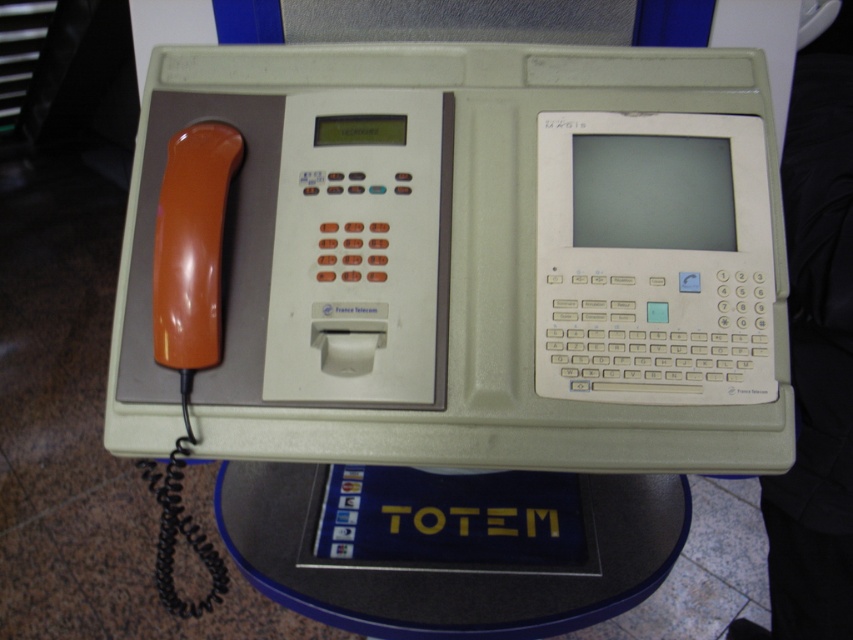
Can you confirm if matte gray phone box at center is positioned to the right of blue plastic round table at center?

Indeed, matte gray phone box at center is positioned on the right side of blue plastic round table at center.

Does matte gray phone box at center have a larger size compared to blue plastic round table at center?

Yes, matte gray phone box at center is bigger than blue plastic round table at center.

The image size is (853, 640). What do you see at coordinates (474, 260) in the screenshot?
I see `matte gray phone box at center` at bounding box center [474, 260].

This screenshot has height=640, width=853. What are the coordinates of `matte gray phone box at center` in the screenshot? It's located at coord(474,260).